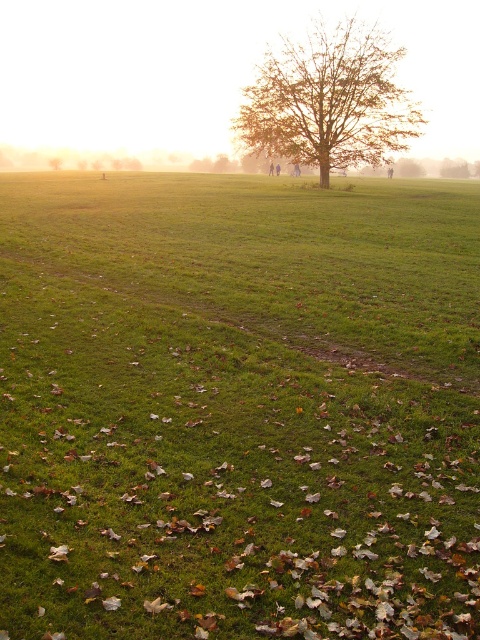
Question: Among these points, which one is farthest from the camera?

Choices:
 (A) (414, 580)
 (B) (411, 131)

Answer: (B)

Question: Can you confirm if green grassy field at center is positioned above brown textured tree at center?

Choices:
 (A) no
 (B) yes

Answer: (A)

Question: Considering the relative positions of green grassy field at center and brown textured tree at center in the image provided, where is green grassy field at center located with respect to brown textured tree at center?

Choices:
 (A) below
 (B) above

Answer: (A)

Question: Which of the following is the farthest from the observer?

Choices:
 (A) green grassy field at center
 (B) brown textured tree at center

Answer: (B)

Question: Can you confirm if green grassy field at center is bigger than brown textured tree at center?

Choices:
 (A) yes
 (B) no

Answer: (B)